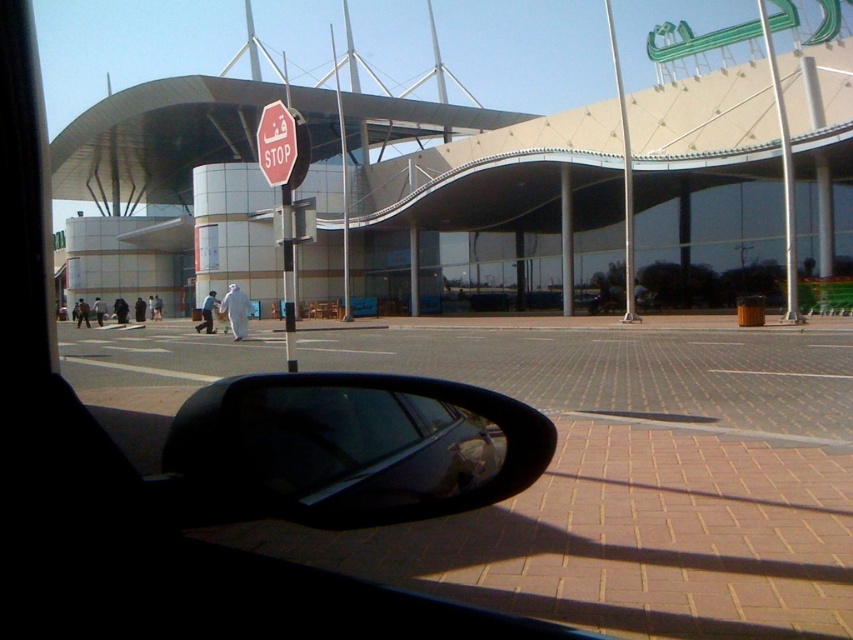
Question: Which object is the closest to the red matte stop sign at center?

Choices:
 (A) metallic pole at center
 (B) black glossy side mirror at lower left

Answer: (B)

Question: Based on their relative distances, which object is nearer to the metallic pole at upper right?

Choices:
 (A) beige glass airport terminal at center
 (B) black glossy side mirror at lower left
 (C) metallic pole at center
 (D) red matte stop sign at center

Answer: (C)

Question: Is black glossy side mirror at lower left bigger than metallic pole at center?

Choices:
 (A) no
 (B) yes

Answer: (A)

Question: Does beige glass airport terminal at center appear over black glossy side mirror at lower left?

Choices:
 (A) yes
 (B) no

Answer: (A)

Question: Among these objects, which one is nearest to the camera?

Choices:
 (A) beige glass airport terminal at center
 (B) red matte stop sign at center
 (C) metallic pole at upper right

Answer: (B)

Question: Is metallic pole at upper right below red matte stop sign at center?

Choices:
 (A) no
 (B) yes

Answer: (A)